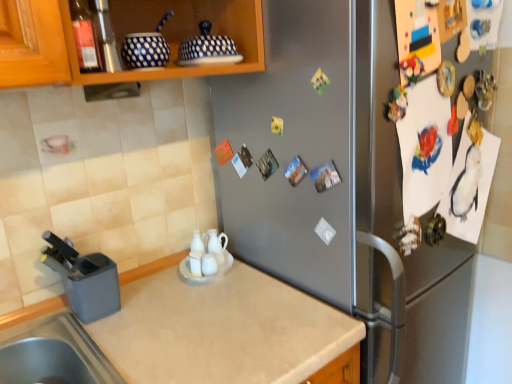
Find the location of a particular element. free space that is to the left of white glossy tea pot at center is located at coordinates (153, 283).